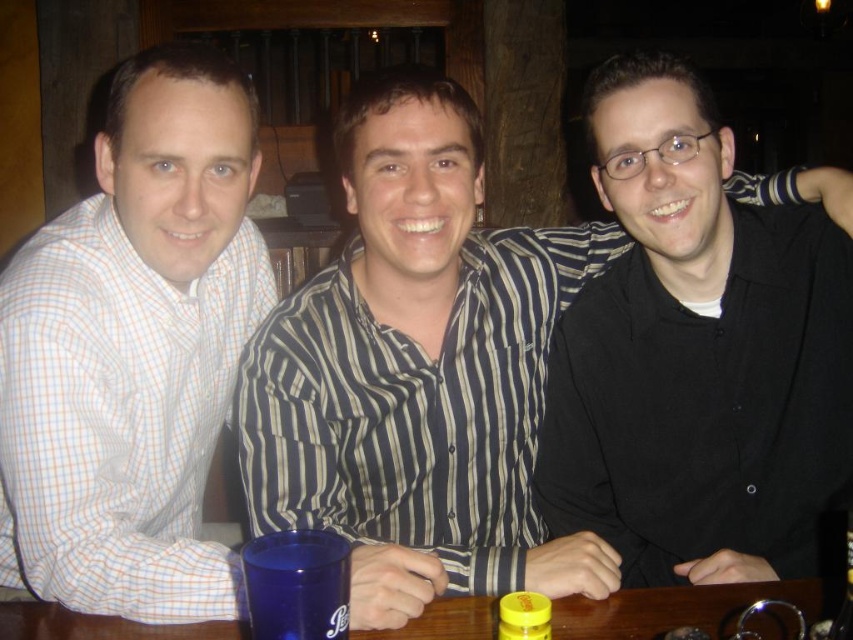
You are a waiter at a restaurant and need to place a new order of drinks and snacks on the table. The table has limited space between the blue plastic cup at lower center and the yellow matte jar at lower center. What is the minimum distance you should maintain between the new items to ensure they don not touch each other?

The minimum distance you should maintain between the new items is 5.92 inches, as the blue plastic cup at lower center is already 5.92 inches away from the yellow matte jar at lower center, so keeping at least that distance will prevent them from touching.

You are a photographer trying to capture a group photo of three people sitting at a table. You notice a point at coordinates (419,358) in the frame. Which person is closest to this point?

The striped shirt at center is closest to the point at (419,358).